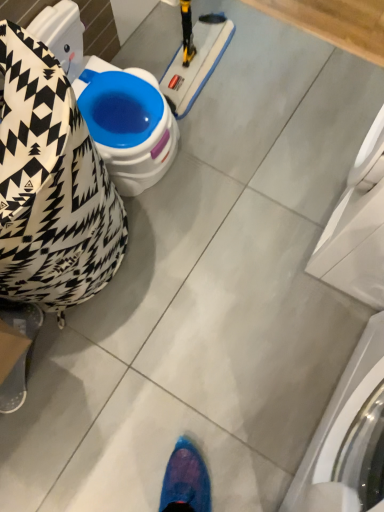
What do you see at coordinates (348, 438) in the screenshot? I see `white glossy washing machine at lower right, arranged as the 1th washing machine when ordered from the bottom` at bounding box center [348, 438].

In order to face black and white patterned bean bag chair at left, should I rotate leftwards or rightwards?

To align with it, rotate left about 22.867°.

At what (x,y) coordinates should I click in order to perform the action: click on white glossy washing machine at right, arranged as the first washing machine when viewed from the top. Please return your answer as a coordinate pair (x, y). Image resolution: width=384 pixels, height=512 pixels. Looking at the image, I should click on (357, 227).

At what (x,y) coordinates should I click in order to perform the action: click on white glossy washing machine at lower right, which is the second washing machine from top to bottom. Please return your answer as a coordinate pair (x, y). The height and width of the screenshot is (512, 384). Looking at the image, I should click on [348, 438].

Is white glossy washing machine at right, the 2th washing machine from the bottom, aimed at black and white patterned bean bag chair at left?

No, white glossy washing machine at right, the 2th washing machine from the bottom, does not turn towards black and white patterned bean bag chair at left.

The width and height of the screenshot is (384, 512). What are the coordinates of `bean bag chair located on the left of white glossy washing machine at right, arranged as the first washing machine when viewed from the top` in the screenshot? It's located at (51, 186).

Does white glossy washing machine at right, arranged as the first washing machine when viewed from the top, have a lesser width compared to black and white patterned bean bag chair at left?

Yes, white glossy washing machine at right, arranged as the first washing machine when viewed from the top, is thinner than black and white patterned bean bag chair at left.

Could black and white patterned bean bag chair at left be considered to be inside white glossy washing machine at right, the 2th washing machine from the bottom?

No, black and white patterned bean bag chair at left is not a part of white glossy washing machine at right, the 2th washing machine from the bottom.

Could you tell me if black and white patterned bean bag chair at left is turned towards white glossy washing machine at lower right, arranged as the 1th washing machine when ordered from the bottom?

Yes, black and white patterned bean bag chair at left is turned towards white glossy washing machine at lower right, arranged as the 1th washing machine when ordered from the bottom.

Locate an element on the screen. Image resolution: width=384 pixels, height=512 pixels. washing machine that is the 1st one when counting rightward from the black and white patterned bean bag chair at left is located at coordinates (348, 438).

Choose the correct answer: Is black and white patterned bean bag chair at left inside white glossy washing machine at lower right, which is the second washing machine from top to bottom, or outside it?

black and white patterned bean bag chair at left is not inside white glossy washing machine at lower right, which is the second washing machine from top to bottom, it's outside.

Is there a large distance between white glossy washing machine at lower right, which is the second washing machine from top to bottom, and white glossy washing machine at right, arranged as the first washing machine when viewed from the top?

They are positioned close to each other.

In terms of size, does white glossy washing machine at lower right, which is the second washing machine from top to bottom, appear bigger or smaller than white glossy washing machine at right, the 2th washing machine from the bottom?

In the image, white glossy washing machine at lower right, which is the second washing machine from top to bottom, appears to be smaller than white glossy washing machine at right, the 2th washing machine from the bottom.

Looking at this image, considering the relative sizes of white glossy washing machine at lower right, arranged as the 1th washing machine when ordered from the bottom, and white glossy washing machine at right, arranged as the first washing machine when viewed from the top, in the image provided, is white glossy washing machine at lower right, arranged as the 1th washing machine when ordered from the bottom, thinner than white glossy washing machine at right, arranged as the first washing machine when viewed from the top,?

Indeed, white glossy washing machine at lower right, arranged as the 1th washing machine when ordered from the bottom, has a lesser width compared to white glossy washing machine at right, arranged as the first washing machine when viewed from the top.

How different are the orientations of white glossy washing machine at lower right, arranged as the 1th washing machine when ordered from the bottom, and white glossy washing machine at right, the 2th washing machine from the bottom, in degrees?

The facing directions of white glossy washing machine at lower right, arranged as the 1th washing machine when ordered from the bottom, and white glossy washing machine at right, the 2th washing machine from the bottom, are 0.383 degrees apart.

Is white glossy washing machine at right, arranged as the first washing machine when viewed from the top, wider than white glossy washing machine at lower right, arranged as the 1th washing machine when ordered from the bottom?

Indeed, white glossy washing machine at right, arranged as the first washing machine when viewed from the top, has a greater width compared to white glossy washing machine at lower right, arranged as the 1th washing machine when ordered from the bottom.

Which is more to the left, white glossy washing machine at right, the 2th washing machine from the bottom, or white glossy washing machine at lower right, arranged as the 1th washing machine when ordered from the bottom?

Positioned to the left is white glossy washing machine at lower right, arranged as the 1th washing machine when ordered from the bottom.

From the image's perspective, which is above, white glossy washing machine at right, arranged as the first washing machine when viewed from the top, or white glossy washing machine at lower right, arranged as the 1th washing machine when ordered from the bottom?

white glossy washing machine at right, arranged as the first washing machine when viewed from the top, appears higher in the image.

Could you tell me if black and white patterned bean bag chair at left is facing white glossy washing machine at right, the 2th washing machine from the bottom?

No, black and white patterned bean bag chair at left is not aimed at white glossy washing machine at right, the 2th washing machine from the bottom.

Considering the relative sizes of black and white patterned bean bag chair at left and white glossy washing machine at right, arranged as the first washing machine when viewed from the top, in the image provided, is black and white patterned bean bag chair at left shorter than white glossy washing machine at right, arranged as the first washing machine when viewed from the top,?

Correct, black and white patterned bean bag chair at left is not as tall as white glossy washing machine at right, arranged as the first washing machine when viewed from the top.

Considering the sizes of objects black and white patterned bean bag chair at left and white glossy washing machine at right, arranged as the first washing machine when viewed from the top, in the image provided, who is thinner, black and white patterned bean bag chair at left or white glossy washing machine at right, arranged as the first washing machine when viewed from the top,?

With smaller width is white glossy washing machine at right, arranged as the first washing machine when viewed from the top.

Does white glossy washing machine at lower right, which is the second washing machine from top to bottom, have a greater height compared to black and white patterned bean bag chair at left?

Yes.

How much distance is there between white glossy washing machine at lower right, which is the second washing machine from top to bottom, and black and white patterned bean bag chair at left?

white glossy washing machine at lower right, which is the second washing machine from top to bottom, is 24.60 inches away from black and white patterned bean bag chair at left.

Does white glossy washing machine at lower right, which is the second washing machine from top to bottom, have a smaller size compared to black and white patterned bean bag chair at left?

No, white glossy washing machine at lower right, which is the second washing machine from top to bottom, is not smaller than black and white patterned bean bag chair at left.

Can you confirm if white glossy washing machine at lower right, arranged as the 1th washing machine when ordered from the bottom, is positioned to the right of black and white patterned bean bag chair at left?

Indeed, white glossy washing machine at lower right, arranged as the 1th washing machine when ordered from the bottom, is positioned on the right side of black and white patterned bean bag chair at left.

This screenshot has width=384, height=512. What are the coordinates of `bean bag chair lying below the white glossy washing machine at right, arranged as the first washing machine when viewed from the top (from the image's perspective)` in the screenshot? It's located at (51, 186).

Starting from the black and white patterned bean bag chair at left, which washing machine is the 2nd one in front? Please provide its 2D coordinates.

[(348, 438)]

Looking at the image, which one is located further to white glossy washing machine at right, arranged as the first washing machine when viewed from the top, white glossy washing machine at lower right, arranged as the 1th washing machine when ordered from the bottom, or black and white patterned bean bag chair at left?

black and white patterned bean bag chair at left is positioned further to the anchor white glossy washing machine at right, arranged as the first washing machine when viewed from the top.

Estimate the real-world distances between objects in this image. Which object is further from white glossy washing machine at lower right, arranged as the 1th washing machine when ordered from the bottom, white glossy washing machine at right, arranged as the first washing machine when viewed from the top, or black and white patterned bean bag chair at left?

black and white patterned bean bag chair at left.

Estimate the real-world distances between objects in this image. Which object is further from black and white patterned bean bag chair at left, white glossy washing machine at right, the 2th washing machine from the bottom, or white glossy washing machine at lower right, which is the second washing machine from top to bottom?

Based on the image, white glossy washing machine at lower right, which is the second washing machine from top to bottom, appears to be further to black and white patterned bean bag chair at left.

Considering their positions, is black and white patterned bean bag chair at left positioned closer to white glossy washing machine at right, arranged as the first washing machine when viewed from the top, than white glossy washing machine at lower right, which is the second washing machine from top to bottom?

The object closer to white glossy washing machine at right, arranged as the first washing machine when viewed from the top, is white glossy washing machine at lower right, which is the second washing machine from top to bottom.

Considering their positions, is black and white patterned bean bag chair at left positioned closer to white glossy washing machine at lower right, arranged as the 1th washing machine when ordered from the bottom, than white glossy washing machine at right, arranged as the first washing machine when viewed from the top?

Among the two, white glossy washing machine at right, arranged as the first washing machine when viewed from the top, is located nearer to white glossy washing machine at lower right, arranged as the 1th washing machine when ordered from the bottom.

Which object lies further to the anchor point black and white patterned bean bag chair at left, white glossy washing machine at lower right, which is the second washing machine from top to bottom, or white glossy washing machine at right, the 2th washing machine from the bottom?

white glossy washing machine at lower right, which is the second washing machine from top to bottom.

Where is `washing machine situated between black and white patterned bean bag chair at left and white glossy washing machine at right, the 2th washing machine from the bottom, from left to right`? The height and width of the screenshot is (512, 384). washing machine situated between black and white patterned bean bag chair at left and white glossy washing machine at right, the 2th washing machine from the bottom, from left to right is located at coordinates (348, 438).